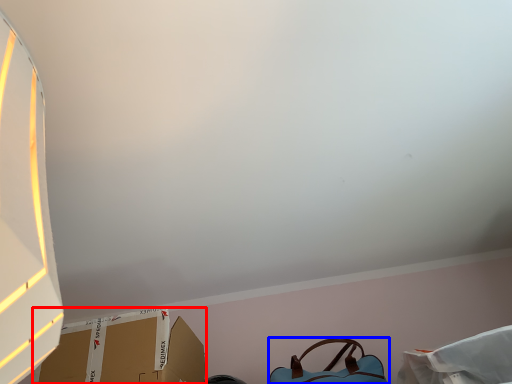
Question: Among these objects, which one is nearest to the camera, cardboard box (highlighted by a red box) or handbag (highlighted by a blue box)?

Choices:
 (A) cardboard box
 (B) handbag

Answer: (A)